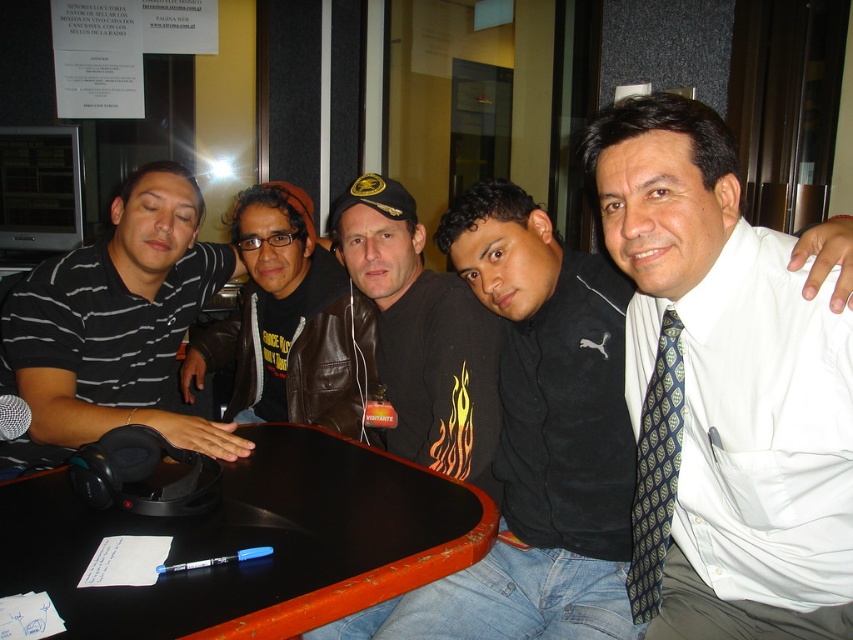
Question: Does black plastic round table at center appear on the left side of blue silk tie at right?

Choices:
 (A) yes
 (B) no

Answer: (A)

Question: Which point appears closest to the camera in this image?

Choices:
 (A) (88, 250)
 (B) (465, 460)
 (C) (817, 636)

Answer: (C)

Question: Is white silk shirt at upper right in front of black leather jacket at center?

Choices:
 (A) no
 (B) yes

Answer: (B)

Question: Which is farther from the blue silk tie at right?

Choices:
 (A) black plastic round table at center
 (B) brown leather jacket at center

Answer: (B)

Question: Is black striped polo shirt at left further to the viewer compared to brown leather jacket at center?

Choices:
 (A) yes
 (B) no

Answer: (B)

Question: Which point appears closest to the camera in this image?

Choices:
 (A) (102, 512)
 (B) (654, 412)
 (C) (254, 410)

Answer: (B)